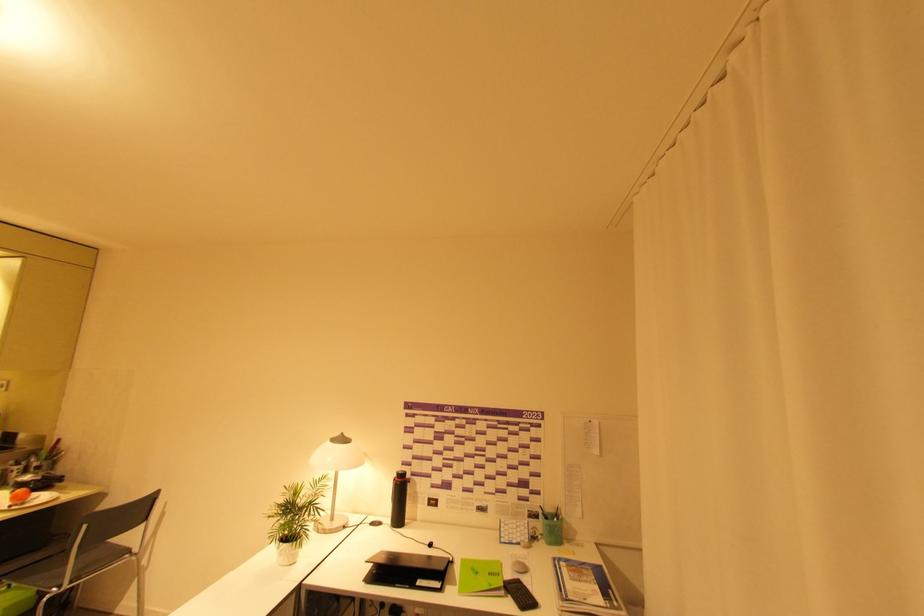
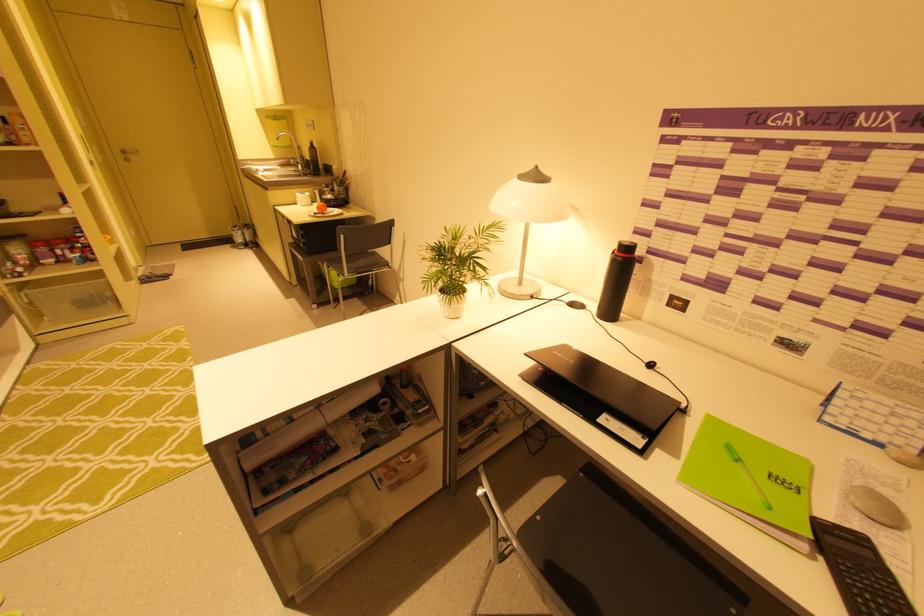
Where in the second image is the point corresponding to (468,561) from the first image?

(714, 419)